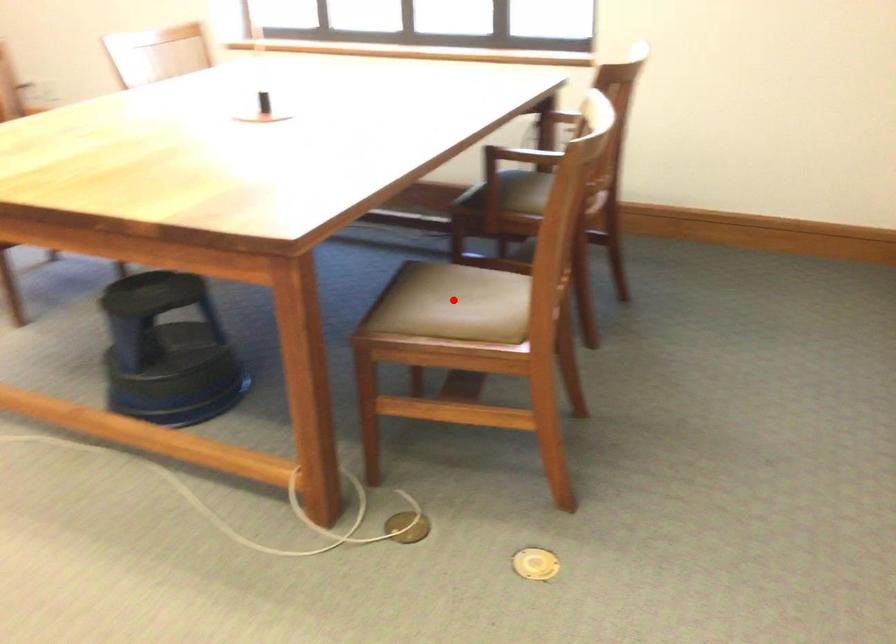
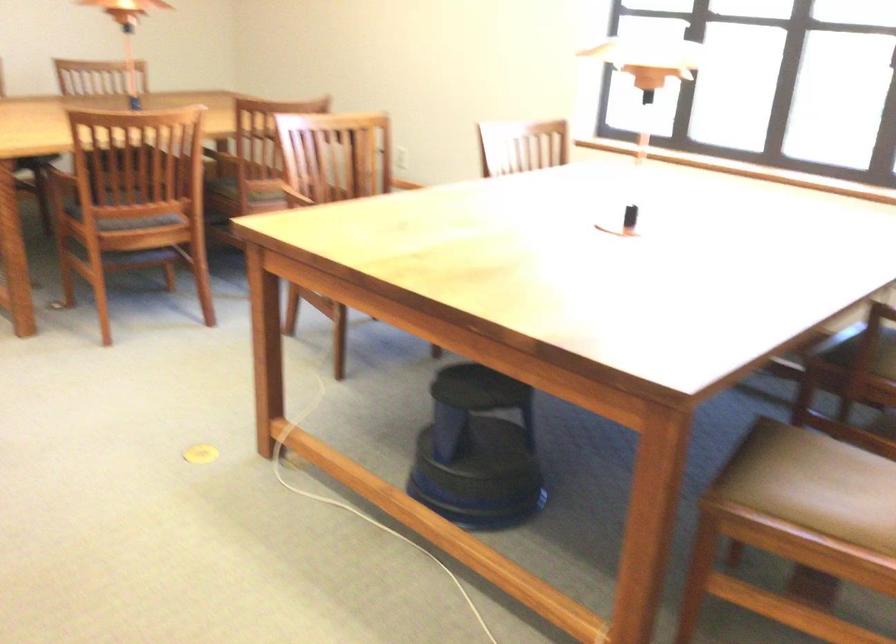
The point at the highlighted location is marked in the first image. Where is the corresponding point in the second image?

(824, 478)